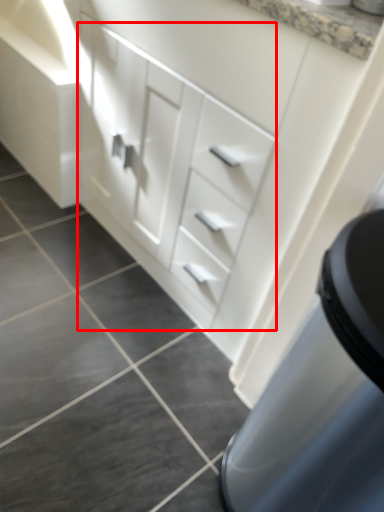
Question: From the image's perspective, what is the correct spatial positioning of drawer (annotated by the red box) in reference to tile?

Choices:
 (A) below
 (B) above

Answer: (B)